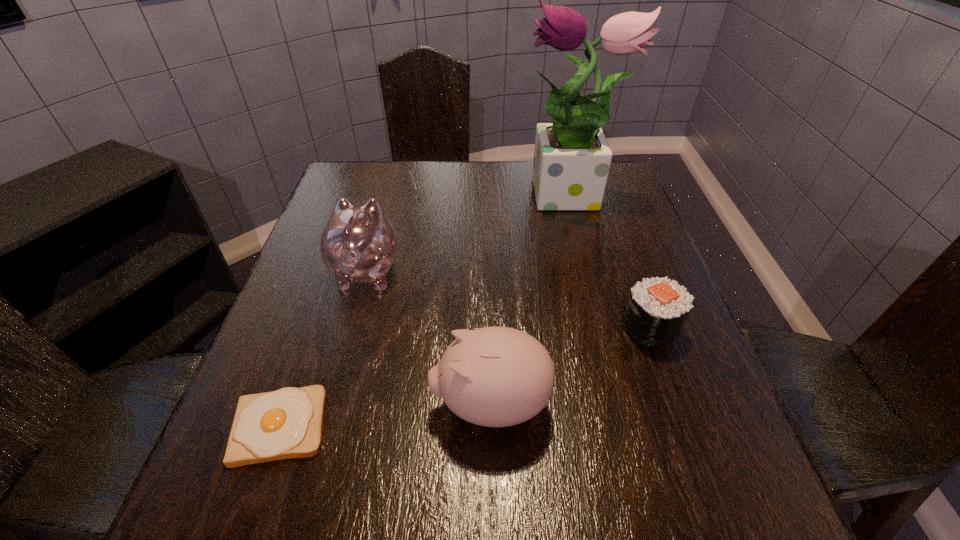
The width and height of the screenshot is (960, 540). I want to click on vacant space located on the front-facing side of the tallest object, so click(417, 198).

This screenshot has height=540, width=960. What are the coordinates of `vacant space located on the front facing side of the left piggy bank` in the screenshot? It's located at (391, 179).

Where is `vacant space located on the front facing side of the left piggy bank`? The height and width of the screenshot is (540, 960). vacant space located on the front facing side of the left piggy bank is located at coordinates (393, 174).

I want to click on free space located on the front facing side of the left piggy bank, so click(383, 208).

The width and height of the screenshot is (960, 540). I want to click on free space located at the snout of the right piggy bank, so click(374, 404).

You are a GUI agent. You are given a task and a screenshot of the screen. Output one action in this format:
    pyautogui.click(x=<x>, y=<y>)
    Task: Click on the blank space located at the snout of the right piggy bank
    
    Given the screenshot: What is the action you would take?
    pyautogui.click(x=357, y=404)

Locate an element on the screen. free space located at the snout of the right piggy bank is located at coordinates (346, 404).

Locate an element on the screen. The image size is (960, 540). vacant space positioned 0.270m on the left of the sushi is located at coordinates (488, 328).

Identify the location of vacant point located 0.080m on the front of the toast. (246, 524).

In order to click on object that is at the far edge in this screenshot , I will do `click(572, 157)`.